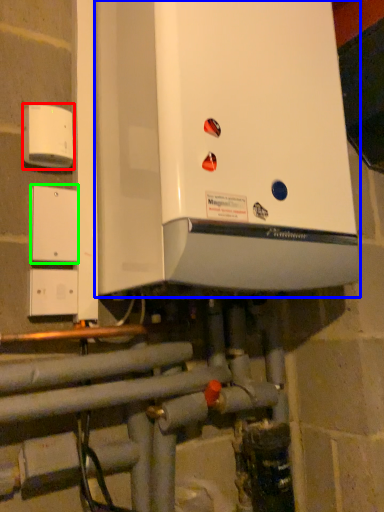
Question: Estimate the real-world distances between objects in this image. Which object is farther from electric outlet (highlighted by a red box), home appliance (highlighted by a blue box) or light switch (highlighted by a green box)?

Choices:
 (A) home appliance
 (B) light switch

Answer: (A)